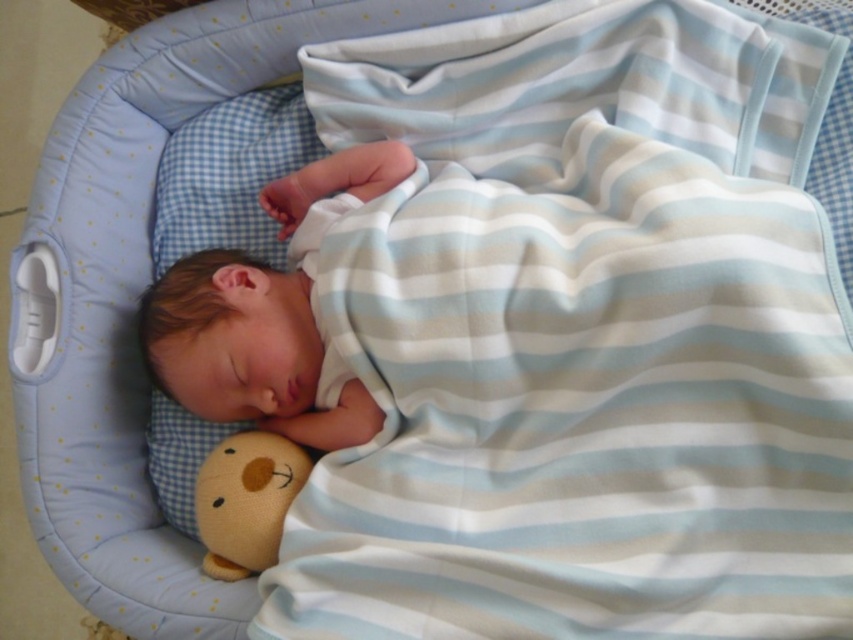
Which is above, white soft newborn at center or soft yellow plush bear at lower left?

white soft newborn at center

Between point (212, 410) and point (253, 481), which one is positioned behind?

Point (212, 410)

Is point (256, 371) positioned before point (300, 481)?

Yes.

Image resolution: width=853 pixels, height=640 pixels. I want to click on white soft newborn at center, so click(270, 314).